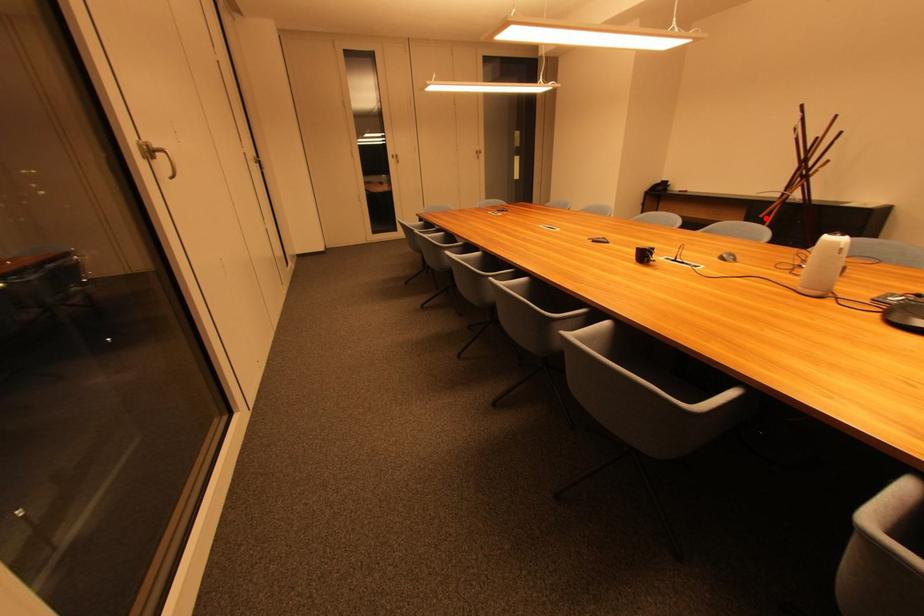
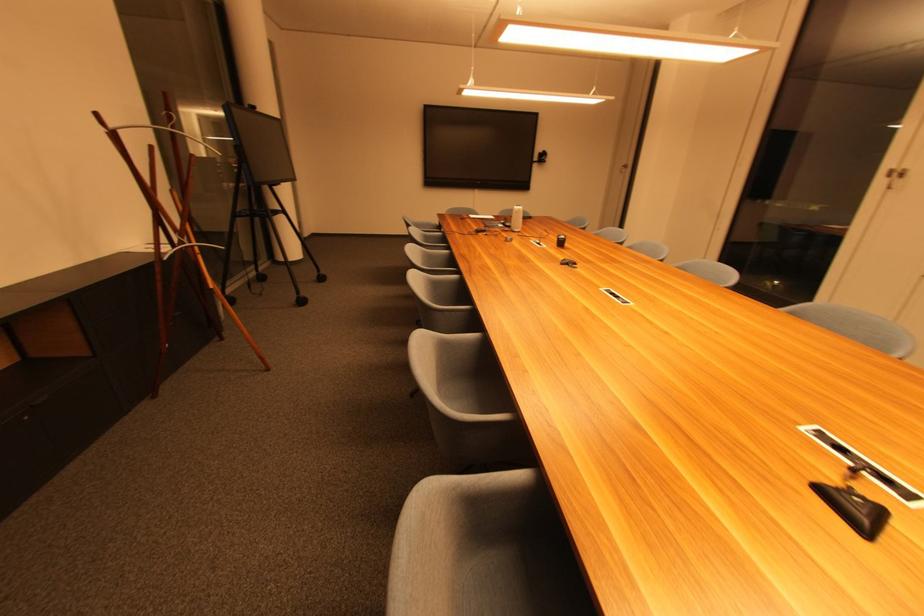
Question: I am providing you with two images of the same scene from different viewpoints. A red point is marked on the first image. At the location where the point appears in image 1, is it still visible in image 2?

Choices:
 (A) Yes
 (B) No

Answer: (A)